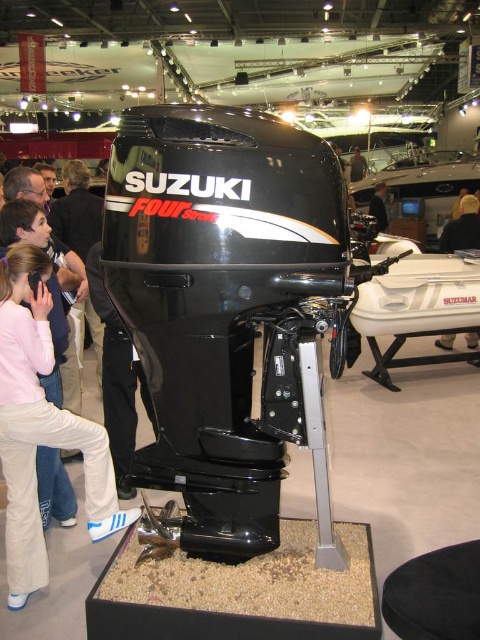
Can you confirm if black plastic outboard motor at center is positioned to the left of black leather jacket at upper center?

Yes, black plastic outboard motor at center is to the left of black leather jacket at upper center.

Who is taller, black plastic outboard motor at center or black leather jacket at upper center?

black plastic outboard motor at center is taller.

Is point (54, 445) closer to viewer compared to point (362, 160)?

Yes, it is.

What are the coordinates of `black plastic outboard motor at center` in the screenshot? It's located at (40, 428).

Can you confirm if black plastic outboard motor at center is smaller than black plastic person at center?

Actually, black plastic outboard motor at center might be larger than black plastic person at center.

Is black plastic outboard motor at center thinner than black plastic person at center?

Incorrect, black plastic outboard motor at center's width is not less than black plastic person at center's.

What are the coordinates of `black plastic outboard motor at center` in the screenshot? It's located at (40, 428).

Image resolution: width=480 pixels, height=640 pixels. I want to click on black plastic outboard motor at center, so click(40, 428).

Who is positioned more to the right, light brown leather jacket at center or black leather jacket at upper center?

light brown leather jacket at center is more to the right.

Can you confirm if light brown leather jacket at center is taller than black leather jacket at upper center?

No, light brown leather jacket at center is not taller than black leather jacket at upper center.

Who is more forward, (468,202) or (355,176)?

Positioned in front is point (468,202).

Image resolution: width=480 pixels, height=640 pixels. In order to click on light brown leather jacket at center in this screenshot , I will do `click(463, 227)`.